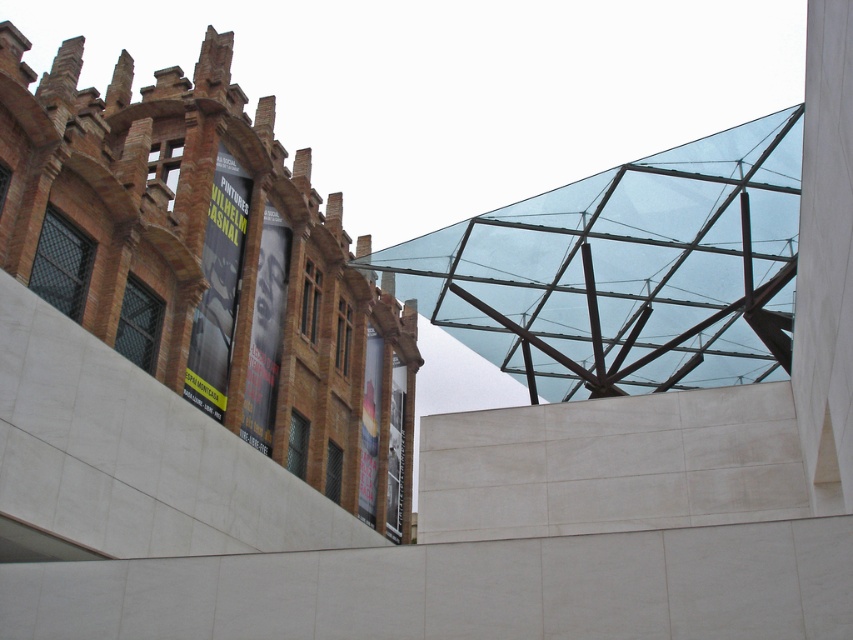
Question: Is transparent glass pyramid at upper center positioned in front of transparent glass roof at upper center?

Choices:
 (A) yes
 (B) no

Answer: (A)

Question: Among these points, which one is nearest to the camera?

Choices:
 (A) (756, 196)
 (B) (155, 76)

Answer: (A)

Question: Can you confirm if transparent glass pyramid at upper center is positioned to the left of transparent glass roof at upper center?

Choices:
 (A) no
 (B) yes

Answer: (B)

Question: Is transparent glass pyramid at upper center smaller than transparent glass roof at upper center?

Choices:
 (A) no
 (B) yes

Answer: (A)

Question: Which object appears farthest from the camera in this image?

Choices:
 (A) transparent glass pyramid at upper center
 (B) transparent glass roof at upper center

Answer: (B)